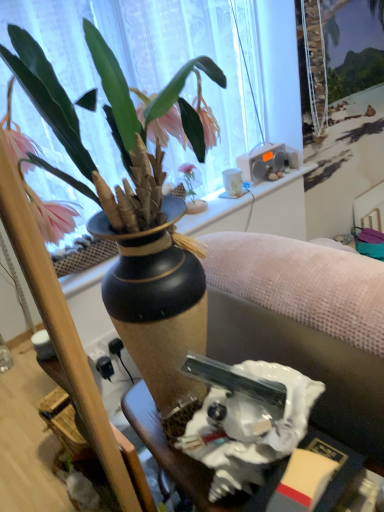
Describe the element at coordinates (304, 324) in the screenshot. The height and width of the screenshot is (512, 384). I see `matte gray couch at center` at that location.

What are the coordinates of `white glossy statue at lower center` in the screenshot? It's located at (170, 451).

The image size is (384, 512). What are the coordinates of `white plastic speaker at upper right` in the screenshot? It's located at (262, 162).

Describe the element at coordinates (191, 189) in the screenshot. I see `pink matte vase at upper center` at that location.

I want to click on matte black vase at upper center, so click(115, 126).

Describe the element at coordinates (115, 126) in the screenshot. This screenshot has height=512, width=384. I see `matte black vase at upper center` at that location.

At what (x,y) coordinates should I click in order to perform the action: click on matte gray couch at center. Please return your answer as a coordinate pair (x, y). This screenshot has width=384, height=512. Looking at the image, I should click on (304, 324).

Relative to white glossy statue at lower center, is pink matte vase at upper center in front or behind?

Clearly, pink matte vase at upper center is behind white glossy statue at lower center.

From the picture: Is pink matte vase at upper center not within white glossy statue at lower center?

Yes, pink matte vase at upper center is outside of white glossy statue at lower center.

From the image's perspective, is pink matte vase at upper center located above or below white glossy statue at lower center?

Based on their image positions, pink matte vase at upper center is located above white glossy statue at lower center.

Between pink matte vase at upper center and white glossy statue at lower center, which one appears on the right side from the viewer's perspective?

Positioned to the right is white glossy statue at lower center.

Would you say white glossy statue at lower center is inside or outside matte black vase at upper center?

white glossy statue at lower center lies outside matte black vase at upper center.

Can you confirm if white glossy statue at lower center is wider than matte black vase at upper center?

Indeed, white glossy statue at lower center has a greater width compared to matte black vase at upper center.

Considering the relative sizes of white glossy statue at lower center and matte black vase at upper center in the image provided, is white glossy statue at lower center bigger than matte black vase at upper center?

→ Incorrect, white glossy statue at lower center is not larger than matte black vase at upper center.

Is matte gray couch at center in front of or behind pink matte vase at upper center in the image?

matte gray couch at center is in front of pink matte vase at upper center.

From the image's perspective, between matte gray couch at center and pink matte vase at upper center, who is located below?

matte gray couch at center.

Which point is more forward, (319,277) or (204,210)?

The point (319,277) is in front.

From a real-world perspective, which is physically below, matte gray couch at center or pink matte vase at upper center?

From a 3D spatial view, matte gray couch at center is below.

From the image's perspective, does white plastic speaker at upper right appear higher than matte gray couch at center?

Yes, from the image's perspective, white plastic speaker at upper right is over matte gray couch at center.

Looking at this image, which of these two, white plastic speaker at upper right or matte gray couch at center, stands shorter?

white plastic speaker at upper right.

From a real-world perspective, is white plastic speaker at upper right positioned above or below matte gray couch at center?

white plastic speaker at upper right is situated higher than matte gray couch at center in the real world.

Is white plastic speaker at upper right positioned beyond the bounds of matte gray couch at center?

white plastic speaker at upper right lies outside matte gray couch at center's area.

Do you think white plastic speaker at upper right is within white glossy statue at lower center, or outside of it?

white plastic speaker at upper right is not inside white glossy statue at lower center, it's outside.

From a real-world perspective, between white plastic speaker at upper right and white glossy statue at lower center, who is vertically lower?

white glossy statue at lower center.

Looking at their sizes, would you say white plastic speaker at upper right is wider or thinner than white glossy statue at lower center?

Clearly, white plastic speaker at upper right has less width compared to white glossy statue at lower center.

Is point (253, 338) farther from viewer compared to point (251, 181)?

No, (253, 338) is in front of (251, 181).

Considering the relative sizes of matte gray couch at center and white plastic speaker at upper right in the image provided, is matte gray couch at center bigger than white plastic speaker at upper right?

Indeed, matte gray couch at center has a larger size compared to white plastic speaker at upper right.

Considering the points (112, 123) and (308, 319), which point is in front, point (112, 123) or point (308, 319)?

The point (112, 123) is closer to the camera.

The image size is (384, 512). I want to click on flower above the matte gray couch at center (from the image's perspective), so click(115, 126).

Between matte black vase at upper center and matte gray couch at center, which one is positioned in front?

matte gray couch at center is in front.

In the scene shown: Do you think matte black vase at upper center is within matte gray couch at center, or outside of it?

matte black vase at upper center is not enclosed by matte gray couch at center.

Where is `desk that appears on the right of pink matte vase at upper center`? desk that appears on the right of pink matte vase at upper center is located at coordinates (170, 451).

At what (x,y) coordinates should I click in order to perform the action: click on desk that is in front of the matte black vase at upper center. Please return your answer as a coordinate pair (x, y). Looking at the image, I should click on (170, 451).

From the image, which object appears to be nearer to white glossy statue at lower center, pink matte vase at upper center or matte black vase at upper center?

Based on the image, matte black vase at upper center appears to be nearer to white glossy statue at lower center.

Which object lies further to the anchor point white glossy statue at lower center, matte black vase at upper center or pink matte vase at upper center?

pink matte vase at upper center.

Looking at the image, which one is located further to matte gray couch at center, matte black vase at upper center or white plastic speaker at upper right?

white plastic speaker at upper right lies further to matte gray couch at center than the other object.

Considering their positions, is matte gray couch at center positioned closer to matte black vase at upper center than pink matte vase at upper center?

matte gray couch at center lies closer to matte black vase at upper center than the other object.

Considering their positions, is matte black vase at upper center positioned further to pink matte vase at upper center than white plastic speaker at upper right?

Among the two, matte black vase at upper center is located further to pink matte vase at upper center.

Considering their positions, is pink matte vase at upper center positioned closer to white plastic speaker at upper right than matte gray couch at center?

pink matte vase at upper center is closer to white plastic speaker at upper right.

Considering their positions, is matte gray couch at center positioned closer to white glossy statue at lower center than pink matte vase at upper center?

matte gray couch at center.

Based on their spatial positions, is white glossy statue at lower center or matte gray couch at center further from matte black vase at upper center?

white glossy statue at lower center lies further to matte black vase at upper center than the other object.

Identify the location of houseplant positioned between matte black vase at upper center and white plastic speaker at upper right from near to far. (191, 189).

Locate an element on the screen. The height and width of the screenshot is (512, 384). studio couch between white glossy statue at lower center and white plastic speaker at upper right from front to back is located at coordinates (304, 324).

The image size is (384, 512). I want to click on flower between white glossy statue at lower center and white plastic speaker at upper right in the front-back direction, so click(115, 126).

You are a GUI agent. You are given a task and a screenshot of the screen. Output one action in this format:
    pyautogui.click(x=<x>, y=<y>)
    Task: Click on the studio couch located between white glossy statue at lower center and pink matte vase at upper center in the depth direction
    The image size is (384, 512).
    Given the screenshot: What is the action you would take?
    pyautogui.click(x=304, y=324)